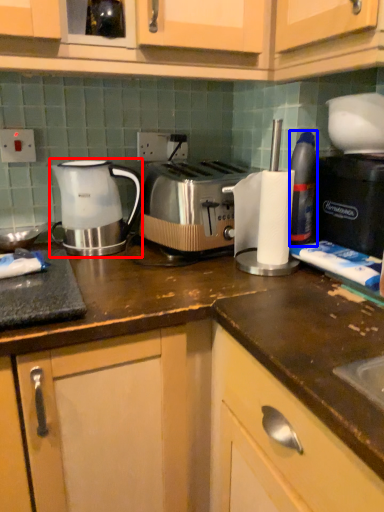
Question: Which object appears farthest to the camera in this image, kettle (highlighted by a red box) or bottle (highlighted by a blue box)?

Choices:
 (A) kettle
 (B) bottle

Answer: (A)